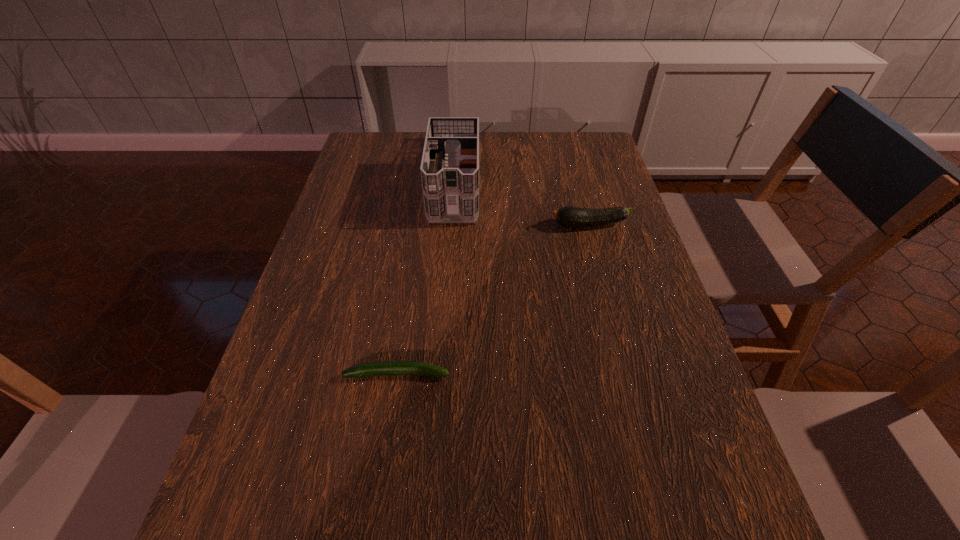
Find the location of a particular element. The image size is (960, 540). dollhouse is located at coordinates (449, 168).

Locate an element on the screen. the right zucchini is located at coordinates (568, 216).

Identify the location of the second tallest object. (568, 216).

Locate an element on the screen. the shorter zucchini is located at coordinates (388, 368).

Locate an element on the screen. the nearest object is located at coordinates (388, 368).

Find the location of a particular element. The width and height of the screenshot is (960, 540). vacant space located at the entrance of the dollhouse is located at coordinates point(448,267).

Where is `free region located 0.170m at the blossom end of the taller zucchini`? free region located 0.170m at the blossom end of the taller zucchini is located at coordinates (487, 225).

At what (x,y) coordinates should I click in order to perform the action: click on blank area located 0.340m at the blossom end of the taller zucchini. Please return your answer as a coordinate pair (x, y). Looking at the image, I should click on [425, 225].

Identify the location of free space located 0.400m at the blossom end of the taller zucchini. (403, 225).

Image resolution: width=960 pixels, height=540 pixels. I want to click on free region located 0.110m on the front-facing side of the shortest object, so click(x=504, y=374).